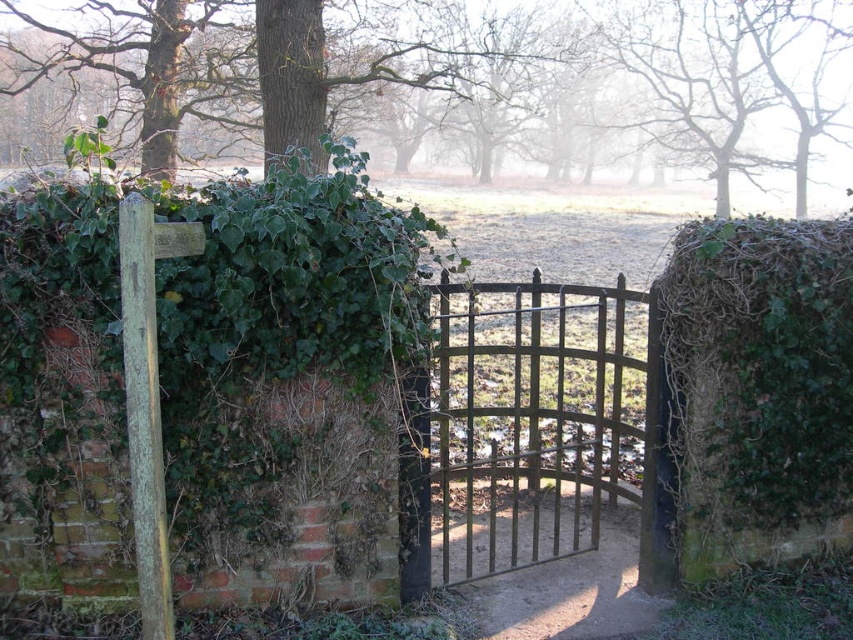
Question: Which is nearer to the brown metal gate at center?

Choices:
 (A) dirt path at center
 (B) green leafy tree at upper left

Answer: (A)

Question: Is dirt path at center to the left of green leafy tree at upper left from the viewer's perspective?

Choices:
 (A) no
 (B) yes

Answer: (B)

Question: Can you confirm if brown metal gate at center is thinner than dirt path at center?

Choices:
 (A) yes
 (B) no

Answer: (A)

Question: Based on their relative distances, which object is nearer to the green leafy tree at upper left?

Choices:
 (A) green ivy at right
 (B) dirt path at center

Answer: (B)

Question: Observing the image, what is the correct spatial positioning of green ivy at right in reference to green leafy tree at upper left?

Choices:
 (A) below
 (B) above

Answer: (A)

Question: Which point is closer to the camera?

Choices:
 (A) brown metal gate at center
 (B) green ivy at right
 (C) green leafy tree at upper left
 (D) dirt path at center

Answer: (B)